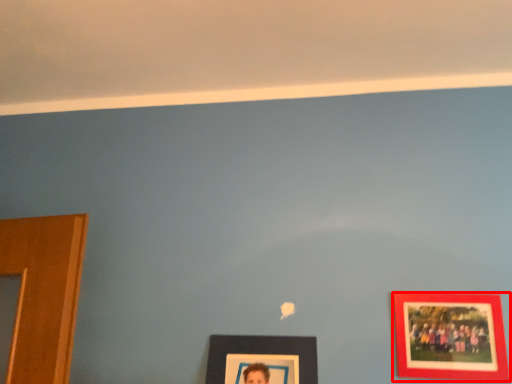
Question: From the image's perspective, what is the correct spatial relationship of picture frame (annotated by the red box) in relation to picture frame?

Choices:
 (A) below
 (B) above

Answer: (B)